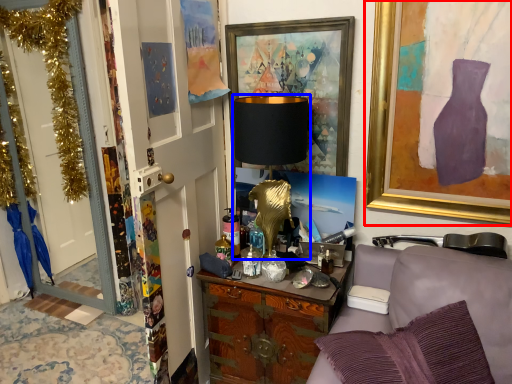
Question: Which object is closer to the camera taking this photo, picture frame (highlighted by a red box) or table lamp (highlighted by a blue box)?

Choices:
 (A) picture frame
 (B) table lamp

Answer: (A)